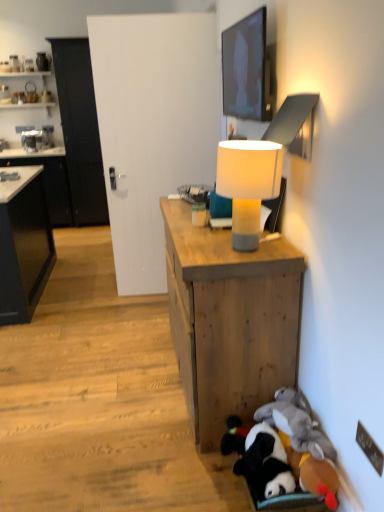
Find the location of a particular element. This screenshot has height=512, width=384. vacant space situated above white fabric lampshade at center (from a real-world perspective) is located at coordinates (241, 142).